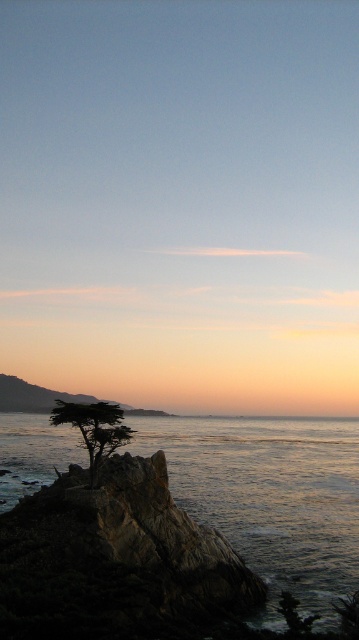
Question: Is shiny silver water at center wider than green matte tree at center?

Choices:
 (A) no
 (B) yes

Answer: (B)

Question: Can you confirm if shiny silver water at center is bigger than green matte tree at center?

Choices:
 (A) yes
 (B) no

Answer: (A)

Question: Which object appears farthest from the camera in this image?

Choices:
 (A) shiny silver water at center
 (B) green matte tree at center

Answer: (B)

Question: Is shiny silver water at center below green matte tree at center?

Choices:
 (A) no
 (B) yes

Answer: (B)